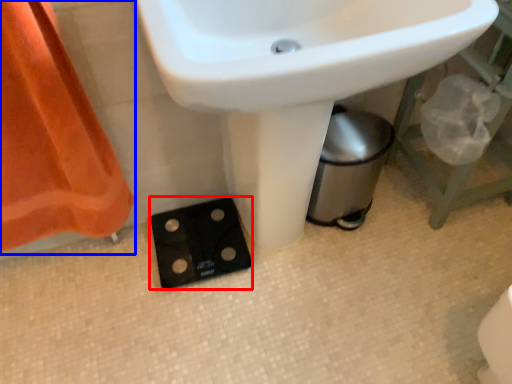
Question: Among these objects, which one is nearest to the camera, socket (highlighted by a red box) or curtain (highlighted by a blue box)?

Choices:
 (A) socket
 (B) curtain

Answer: (B)